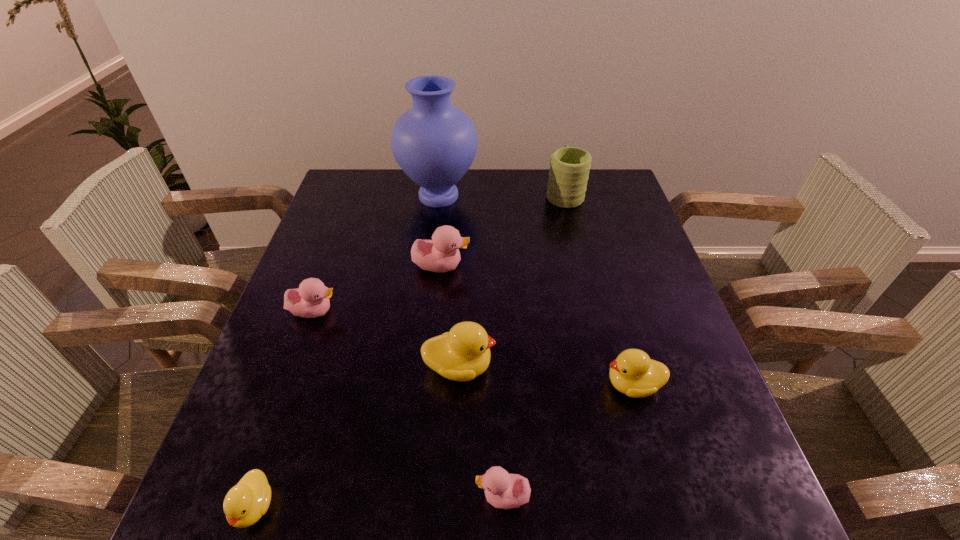
This screenshot has height=540, width=960. What are the coordinates of `vacant space at the far edge of the desktop` in the screenshot? It's located at (524, 200).

In the image, there is a desktop. What are the coordinates of `free region at the left edge` in the screenshot? It's located at (312, 250).

Where is `free space at the right edge of the desktop`? The image size is (960, 540). free space at the right edge of the desktop is located at coordinates (598, 240).

Where is `vacant space at the far left corner`? vacant space at the far left corner is located at coordinates (344, 188).

In the image, there is a desktop. At what (x,y) coordinates should I click in order to perform the action: click on vacant space at the near left corner. Please return your answer as a coordinate pair (x, y). Image resolution: width=960 pixels, height=540 pixels. Looking at the image, I should click on (293, 529).

In order to click on vacant space that's between the biggest yellow duckling and the second biggest pink duckling in this screenshot , I will do `click(387, 339)`.

This screenshot has height=540, width=960. In order to click on vacant space that is in between the smallest yellow duckling and the biggest yellow duckling in this screenshot , I will do `click(356, 436)`.

The image size is (960, 540). I want to click on free space between the second biggest yellow duckling and the nearest pink duckling, so click(567, 441).

Locate an element on the screen. The width and height of the screenshot is (960, 540). vacant area between the second yellow duckling from left to right and the smallest yellow duckling is located at coordinates (356, 436).

Identify the location of vacant space in between the second nearest pink duckling and the rightmost pink duckling. (409, 404).